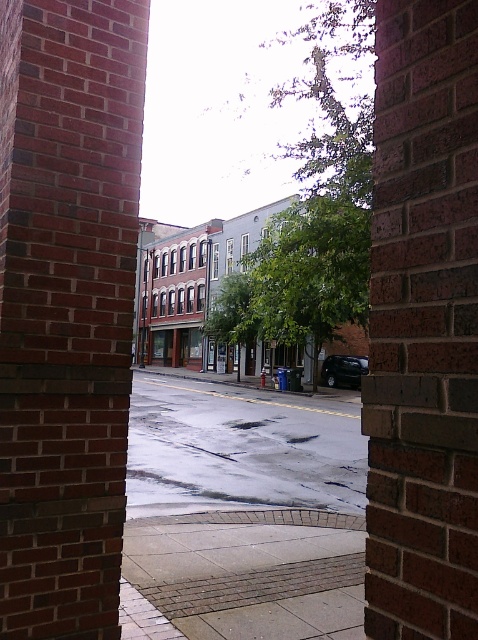
Can you confirm if smooth concrete pavement at center is wider than shiny black car at center?

Correct, the width of smooth concrete pavement at center exceeds that of shiny black car at center.

Does smooth concrete pavement at center appear over shiny black car at center?

Yes, smooth concrete pavement at center is above shiny black car at center.

I want to click on smooth concrete pavement at center, so pyautogui.click(x=243, y=576).

Image resolution: width=478 pixels, height=640 pixels. I want to click on smooth concrete pavement at center, so click(x=243, y=576).

Is smooth concrete pavement at center smaller than wet asphalt at center?

Indeed, smooth concrete pavement at center has a smaller size compared to wet asphalt at center.

Does smooth concrete pavement at center appear over wet asphalt at center?

Indeed, smooth concrete pavement at center is positioned over wet asphalt at center.

Locate an element on the screen. smooth concrete pavement at center is located at coordinates (243, 576).

At what (x,y) coordinates should I click in order to perform the action: click on smooth concrete pavement at center. Please return your answer as a coordinate pair (x, y). The width and height of the screenshot is (478, 640). Looking at the image, I should click on click(x=243, y=576).

Which is more to the right, wet asphalt at center or shiny black car at center?

Positioned to the right is shiny black car at center.

Describe the element at coordinates (241, 445) in the screenshot. I see `wet asphalt at center` at that location.

This screenshot has height=640, width=478. Identify the location of wet asphalt at center. (241, 445).